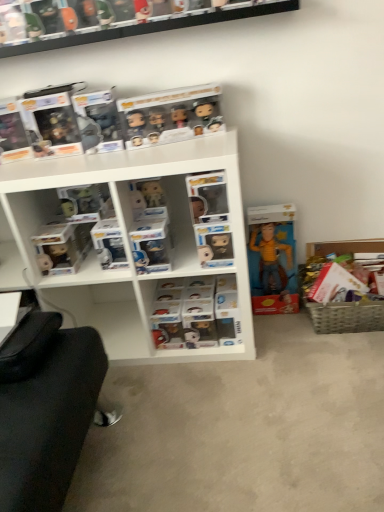
This screenshot has width=384, height=512. I want to click on vacant area located to the right-hand side of clear plastic figures at center, so click(x=290, y=336).